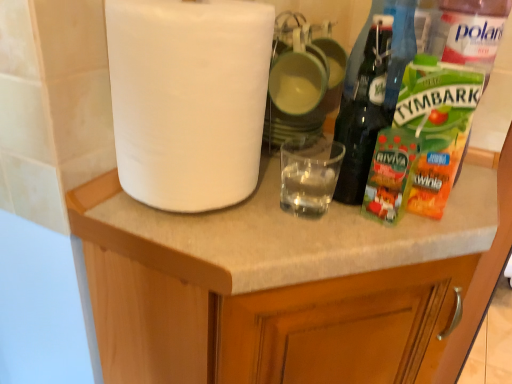
This screenshot has height=384, width=512. I want to click on vacant area that lies to the right of white matte paper towel at upper left, so click(318, 217).